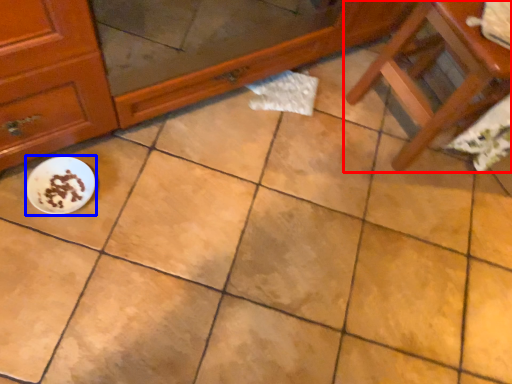
Question: Which object appears closest to the camera in this image, furniture (highlighted by a red box) or meal (highlighted by a blue box)?

Choices:
 (A) furniture
 (B) meal

Answer: (A)